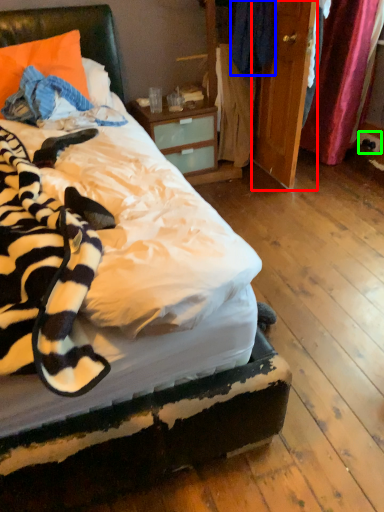
Question: Which object is the closest to the armoire (highlighted by a red box)? Choose among these: clothing (highlighted by a blue box) or power outlet (highlighted by a green box).

Choices:
 (A) clothing
 (B) power outlet

Answer: (A)